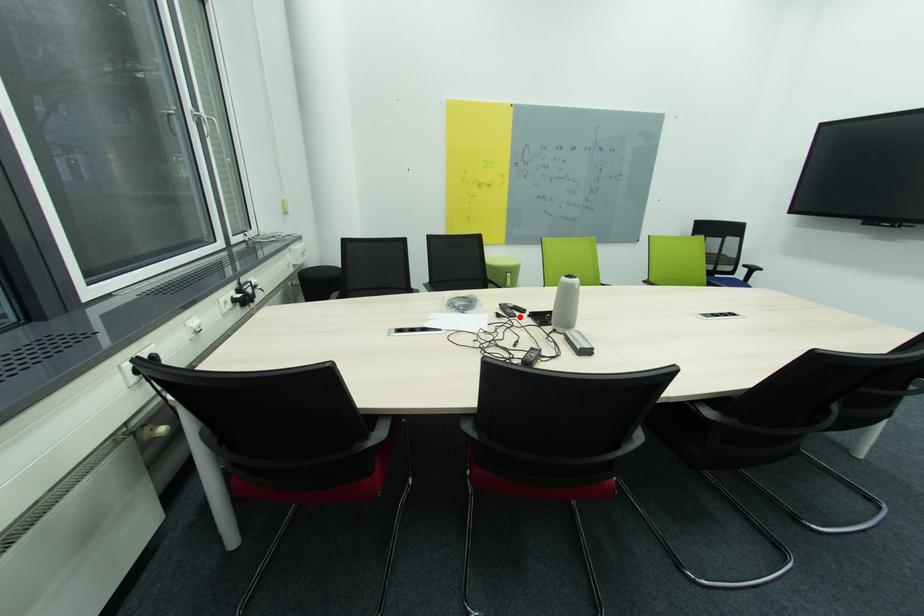
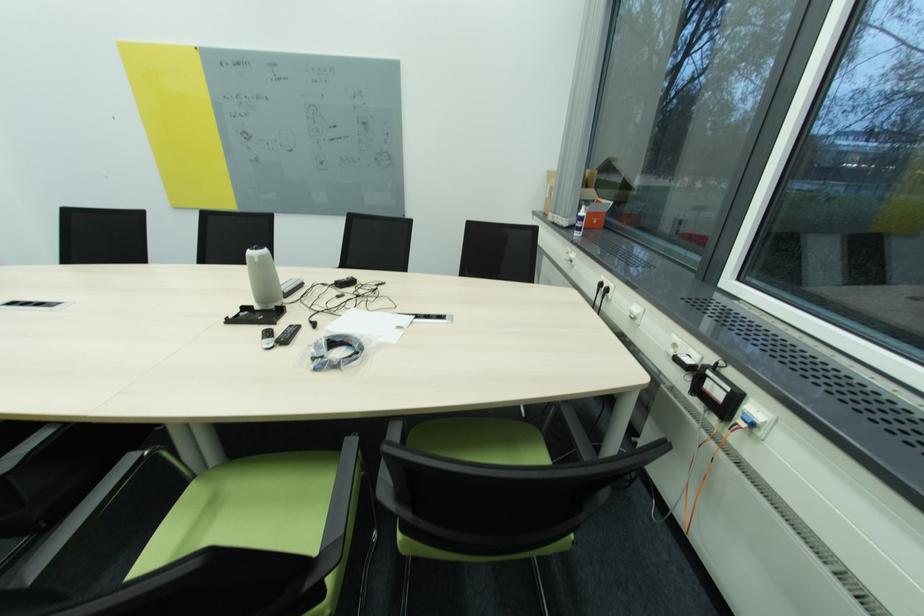
Find the pixel in the second image that matches the highlighted location in the first image.

(296, 328)